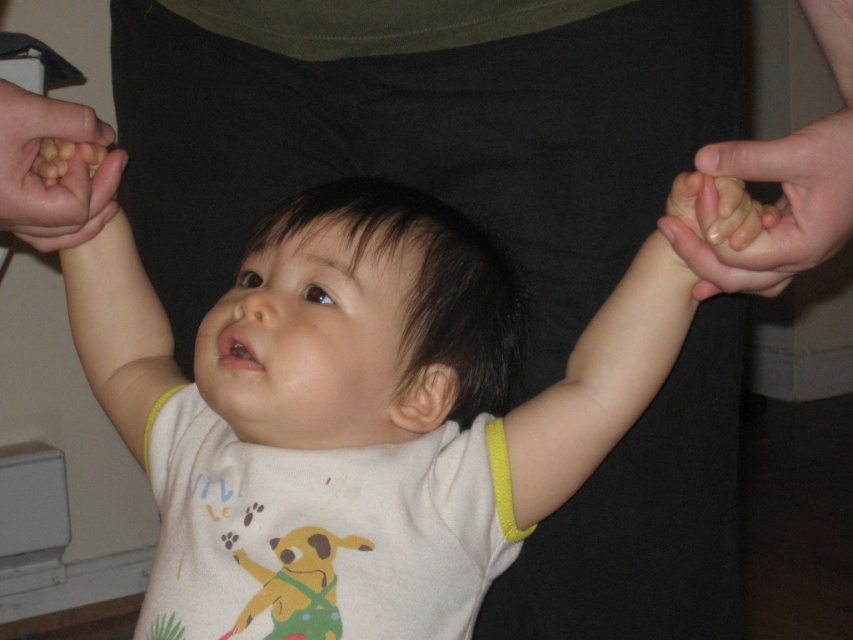
Question: Does smooth skin hand at right have a larger size compared to matte skin hand at left?

Choices:
 (A) yes
 (B) no

Answer: (A)

Question: Which of these objects is positioned closest to the yellow fabric wristband at right?

Choices:
 (A) yellow fabric arm at upper left
 (B) smooth skin hand at right
 (C) matte skin hand at left

Answer: (B)

Question: Estimate the real-world distances between objects in this image. Which object is farther from the yellow fabric wristband at right?

Choices:
 (A) smooth skin hand at right
 (B) yellow fabric arm at upper left

Answer: (B)

Question: Does yellow fabric arm at upper left have a lesser width compared to matte skin hand at left?

Choices:
 (A) yes
 (B) no

Answer: (B)

Question: Can you confirm if smooth skin hand at right is smaller than matte skin hand at left?

Choices:
 (A) no
 (B) yes

Answer: (A)

Question: Which is nearer to the yellow fabric wristband at right?

Choices:
 (A) matte skin hand at left
 (B) yellow fabric arm at upper left

Answer: (B)